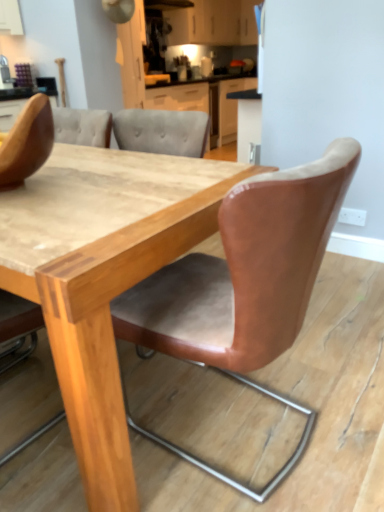
Question: Which direction should I rotate to look at leather-like tan chair at center, positioned as the second chair in left-to-right order, — up or down?

Choices:
 (A) up
 (B) down

Answer: (B)

Question: Should I look upward or downward to see brown leather chair at upper left, arranged as the second chair when viewed from the right?

Choices:
 (A) up
 (B) down

Answer: (A)

Question: Does wooden table at center come in front of matte white cabinets at upper center?

Choices:
 (A) yes
 (B) no

Answer: (A)

Question: From the image's perspective, is wooden table at center located beneath matte white cabinets at upper center?

Choices:
 (A) yes
 (B) no

Answer: (A)

Question: Would you consider wooden table at center to be distant from matte white cabinets at upper center?

Choices:
 (A) yes
 (B) no

Answer: (A)

Question: Does wooden table at center have a larger size compared to matte white cabinets at upper center?

Choices:
 (A) no
 (B) yes

Answer: (B)

Question: Is wooden table at center shorter than matte white cabinets at upper center?

Choices:
 (A) yes
 (B) no

Answer: (B)

Question: Is wooden table at center positioned with its back to matte white cabinets at upper center?

Choices:
 (A) no
 (B) yes

Answer: (A)

Question: From a real-world perspective, is brown leather chair at upper left, arranged as the second chair when viewed from the right, located beneath wooden table at center?

Choices:
 (A) yes
 (B) no

Answer: (B)

Question: Is brown leather chair at upper left, which is counted as the 1th chair, starting from the left, aimed at wooden table at center?

Choices:
 (A) yes
 (B) no

Answer: (B)

Question: Is brown leather chair at upper left, arranged as the second chair when viewed from the right, behind wooden table at center?

Choices:
 (A) yes
 (B) no

Answer: (A)

Question: Can you confirm if brown leather chair at upper left, which is counted as the 1th chair, starting from the left, is wider than wooden table at center?

Choices:
 (A) no
 (B) yes

Answer: (A)

Question: Is brown leather chair at upper left, arranged as the second chair when viewed from the right, taller than wooden table at center?

Choices:
 (A) yes
 (B) no

Answer: (B)

Question: Considering the relative positions of brown leather chair at upper left, arranged as the second chair when viewed from the right, and wooden table at center in the image provided, is brown leather chair at upper left, arranged as the second chair when viewed from the right, to the left of wooden table at center from the viewer's perspective?

Choices:
 (A) no
 (B) yes

Answer: (A)

Question: Is leather-like tan chair at center, positioned as the second chair in left-to-right order, at the right side of matte white cabinets at upper center?

Choices:
 (A) no
 (B) yes

Answer: (A)